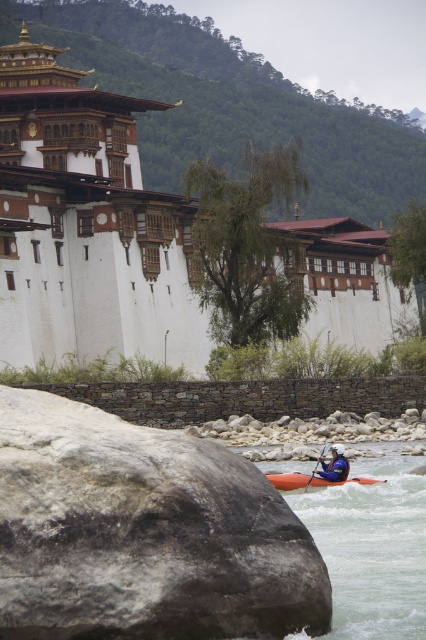
Can you confirm if rough gray rock at lower left is smaller than blue fabric helmet at lower center?

Incorrect, rough gray rock at lower left is not smaller in size than blue fabric helmet at lower center.

Which is behind, point (166, 609) or point (331, 452)?

The point (331, 452) is more distant.

This screenshot has width=426, height=640. Find the location of `rough gray rock at lower left`. rough gray rock at lower left is located at coordinates (143, 532).

Find the location of a particular element. This screenshot has width=426, height=640. rough gray rock at lower left is located at coordinates click(143, 532).

Is rough gray rock at lower left thinner than white painted stone building at upper left?

Indeed, rough gray rock at lower left has a lesser width compared to white painted stone building at upper left.

Who is more distant from viewer, (x=154, y=500) or (x=330, y=225)?

Point (x=330, y=225)

At what (x,y) coordinates should I click in order to perform the action: click on rough gray rock at lower left. Please return your answer as a coordinate pair (x, y). The height and width of the screenshot is (640, 426). Looking at the image, I should click on (143, 532).

Between white painted stone building at upper left and orange matte kayak at lower center, which one is positioned lower?

orange matte kayak at lower center is below.

Consider the image. Is white painted stone building at upper left in front of orange matte kayak at lower center?

That is False.

Which is behind, point (57, 173) or point (273, 481)?

The point (57, 173) is behind.

The height and width of the screenshot is (640, 426). Identify the location of white painted stone building at upper left. (88, 227).